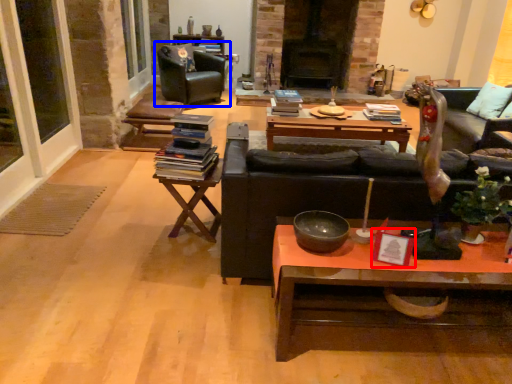
Question: Among these objects, which one is farthest to the camera, picture frame (highlighted by a red box) or chair (highlighted by a blue box)?

Choices:
 (A) picture frame
 (B) chair

Answer: (B)